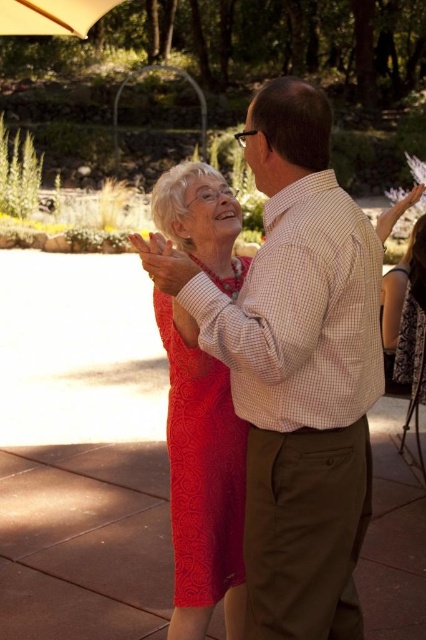
Question: Among these objects, which one is nearest to the camera?

Choices:
 (A) beige fabric umbrella at upper left
 (B) checkered fabric shirt at center

Answer: (B)

Question: Is checkered fabric shirt at center further to the viewer compared to beige fabric umbrella at upper left?

Choices:
 (A) no
 (B) yes

Answer: (A)

Question: Which point is closer to the camera?

Choices:
 (A) matte lace dress at center
 (B) beige fabric umbrella at upper left
 (C) checkered fabric shirt at center

Answer: (C)

Question: Which point appears closest to the camera in this image?

Choices:
 (A) (293, 99)
 (B) (58, 4)

Answer: (A)

Question: Is checkered fabric shirt at center to the left of matte lace dress at center from the viewer's perspective?

Choices:
 (A) no
 (B) yes

Answer: (A)

Question: Is checkered fabric shirt at center below beige fabric umbrella at upper left?

Choices:
 (A) yes
 (B) no

Answer: (A)